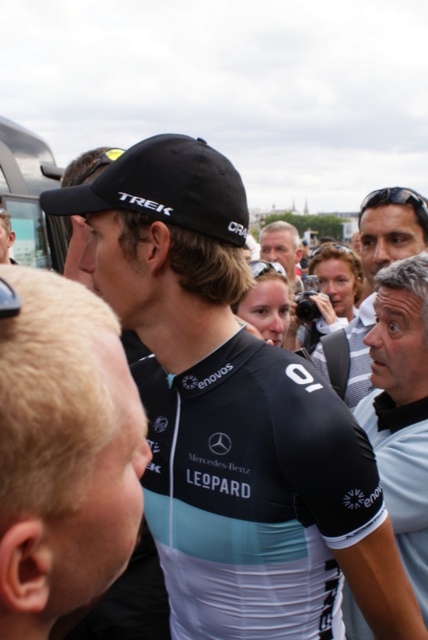
Looking at this image, which of these two, black jersey at center or gray fabric shirt at right, stands shorter?

With less height is black jersey at center.

At what (x,y) coordinates should I click in order to perform the action: click on black jersey at center. Please return your answer as a coordinate pair (x, y). The width and height of the screenshot is (428, 640). Looking at the image, I should click on (64, 452).

Find the location of a particular element. The height and width of the screenshot is (640, 428). black jersey at center is located at coordinates (64, 452).

Is black matte jersey at center positioned behind light brown hair at center?

No, black matte jersey at center is closer to the viewer.

Which is below, black matte jersey at center or light brown hair at center?

Positioned lower is black matte jersey at center.

Is point (214, 339) closer to viewer compared to point (294, 280)?

Yes, point (214, 339) is closer to viewer.

Where is `black matte jersey at center`? This screenshot has height=640, width=428. black matte jersey at center is located at coordinates (232, 417).

Is point (145, 156) positioned behind point (26, 522)?

Yes.

Between black matte jersey at center and black jersey at center, which one is positioned lower?

black jersey at center is lower down.

You are a GUI agent. You are given a task and a screenshot of the screen. Output one action in this format:
    pyautogui.click(x=<x>, y=<y>)
    Task: Click on the black matte jersey at center
    
    Given the screenshot: What is the action you would take?
    pyautogui.click(x=232, y=417)